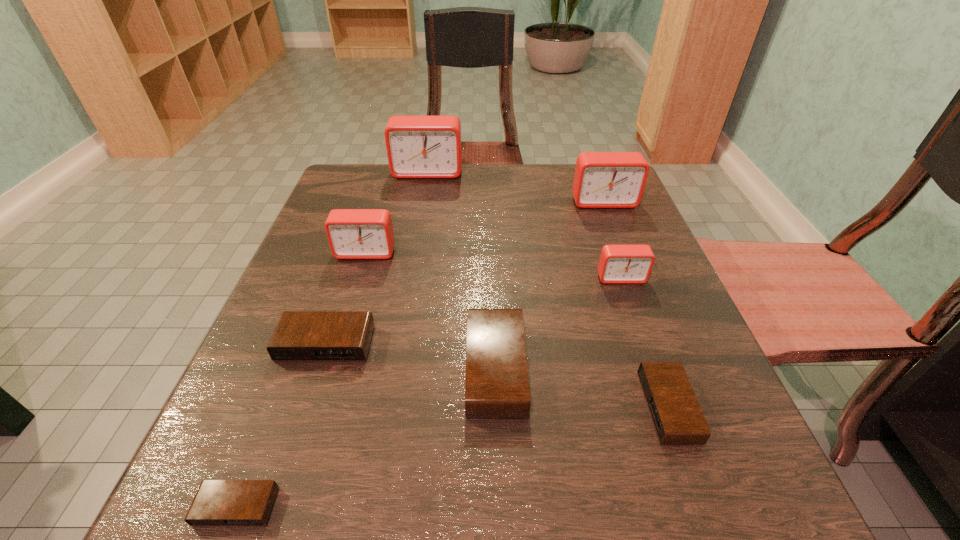
The image size is (960, 540). I want to click on vacant space positioned 0.080m on the front face of the biggest black alarm clock, so click(416, 368).

The image size is (960, 540). In order to click on free location located on the front face of the biggest black alarm clock in this screenshot , I will do [x=276, y=368].

The width and height of the screenshot is (960, 540). What are the coordinates of `vacant position located 0.290m on the front face of the biggest black alarm clock` in the screenshot? It's located at (282, 368).

Locate an element on the screen. The image size is (960, 540). free region located on the front face of the third shortest object is located at coordinates (285, 467).

Where is `vacant area situated 0.060m on the front face of the second smallest black alarm clock`? Image resolution: width=960 pixels, height=540 pixels. vacant area situated 0.060m on the front face of the second smallest black alarm clock is located at coordinates (607, 407).

Find the location of a particular element. This screenshot has width=960, height=540. vacant position located on the front face of the second smallest black alarm clock is located at coordinates (387, 407).

Find the location of a particular element. This screenshot has width=960, height=540. blank area located 0.090m on the front face of the second smallest black alarm clock is located at coordinates (586, 407).

The height and width of the screenshot is (540, 960). I want to click on object that is positioned at the near edge, so click(218, 503).

Locate an element on the screen. Image resolution: width=960 pixels, height=540 pixels. object situated at the far left corner is located at coordinates (417, 146).

You are a GUI agent. You are given a task and a screenshot of the screen. Output one action in this format:
    pyautogui.click(x=<x>, y=<y>)
    Task: Click on the object positioned at the near left corner
    This screenshot has width=960, height=540.
    Given the screenshot: What is the action you would take?
    pyautogui.click(x=218, y=503)